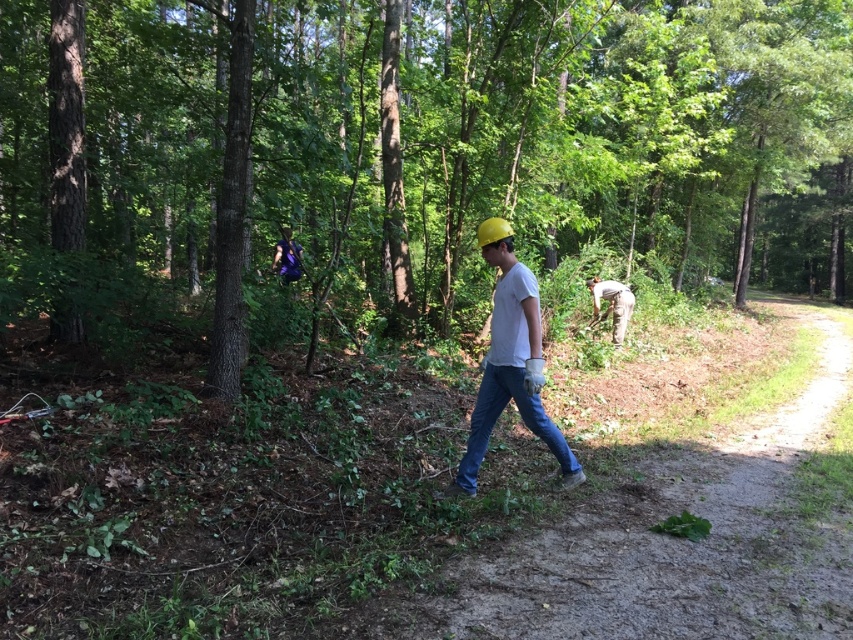
Is green leafy tree at center wider than smooth dirt path at center?

Yes, green leafy tree at center is wider than smooth dirt path at center.

Which is above, green leafy tree at center or smooth dirt path at center?

green leafy tree at center is above.

Who is more forward, (345, 68) or (668, 605)?

Point (668, 605) is more forward.

At what (x,y) coordinates should I click in order to perform the action: click on green leafy tree at center. Please return your answer as a coordinate pair (x, y). Image resolution: width=853 pixels, height=640 pixels. Looking at the image, I should click on (409, 157).

Who is more forward, [340,51] or [618,332]?

Point [618,332] is in front.

Does green leafy tree at center appear on the left side of camouflage pants at center?

In fact, green leafy tree at center is to the right of camouflage pants at center.

Does point (13, 246) come farther from viewer compared to point (621, 284)?

No, it is in front of (621, 284).

Locate an element on the screen. The width and height of the screenshot is (853, 640). green leafy tree at center is located at coordinates (409, 157).

Can you confirm if smooth dirt path at center is wider than purple fabric backpack at center?

Indeed, smooth dirt path at center has a greater width compared to purple fabric backpack at center.

How much distance is there between smooth dirt path at center and purple fabric backpack at center?

smooth dirt path at center is 5.90 meters from purple fabric backpack at center.

Find the location of a particular element. smooth dirt path at center is located at coordinates (671, 544).